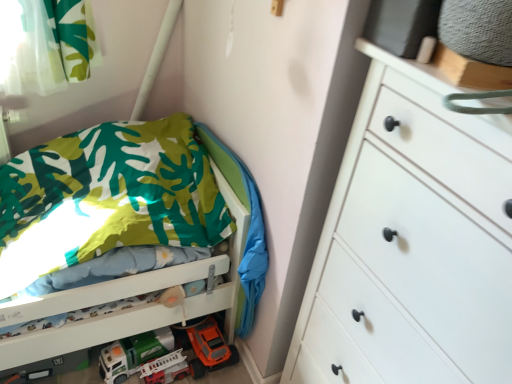
Question: Is point (150, 375) closer or farther from the camera than point (99, 364)?

Choices:
 (A) closer
 (B) farther

Answer: (A)

Question: Is matte white plastic fire truck at lower left, placed as the 2th toy car when sorted from left to right, spatially inside white plastic toy car at lower center, which is the first toy car in left-to-right order, or outside of it?

Choices:
 (A) inside
 (B) outside

Answer: (B)

Question: Which of these objects is positioned closest to the orange plastic toy car at lower center?

Choices:
 (A) green fabric blanket at lower left
 (B) printed fabric bed at left
 (C) white plastic toy car at lower center, which is the first toy car in left-to-right order
 (D) matte white plastic fire truck at lower left, marked as the first toy car in a right-to-left arrangement
 (E) white matte chest of drawers at right

Answer: (D)

Question: Which of these objects is positioned closest to the white plastic toy car at lower center, marked as the second toy car in a right-to-left arrangement?

Choices:
 (A) white matte chest of drawers at right
 (B) green fabric blanket at lower left
 (C) orange plastic toy car at lower center
 (D) printed fabric bed at left
 (E) matte white plastic fire truck at lower left, marked as the first toy car in a right-to-left arrangement

Answer: (E)